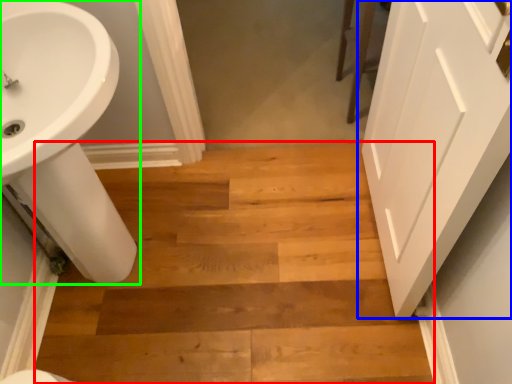
Question: Which object is the farthest from stairwell (highlighted by a red box)? Choose among these: door (highlighted by a blue box) or sink (highlighted by a green box).

Choices:
 (A) door
 (B) sink

Answer: (A)